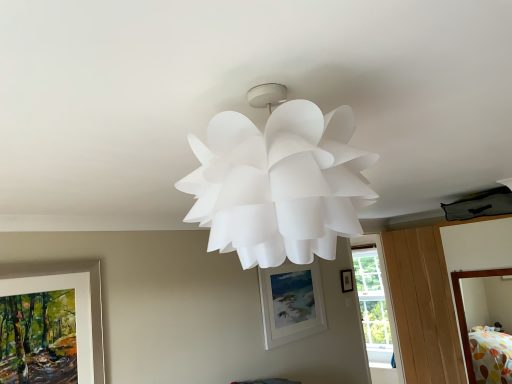
How much space does white matte picture frame at center, the 2th picture frame in the front-to-back sequence, occupy horizontally?

It is 1.56 inches.

What do you see at coordinates (76, 303) in the screenshot? The width and height of the screenshot is (512, 384). I see `matte white picture frame at left, the third picture frame when ordered from back to front` at bounding box center [76, 303].

What do you see at coordinates (376, 309) in the screenshot? I see `transparent glass window at center` at bounding box center [376, 309].

What is the approximate height of matte black picture frame at upper center, which is the 1th picture frame in right-to-left order?

matte black picture frame at upper center, which is the 1th picture frame in right-to-left order, is 8.77 inches tall.

I want to click on matte black picture frame at upper center, positioned as the 3th picture frame in left-to-right order, so click(346, 280).

What do you see at coordinates (464, 311) in the screenshot?
I see `polka dot fabric bed at lower right` at bounding box center [464, 311].

Where is `white matte picture frame at center, arranged as the 2th picture frame when viewed from the right`? This screenshot has width=512, height=384. white matte picture frame at center, arranged as the 2th picture frame when viewed from the right is located at coordinates (291, 302).

From the image's perspective, which is above, transparent glass window at center or matte black picture frame at upper center, positioned as the 3th picture frame in left-to-right order?

matte black picture frame at upper center, positioned as the 3th picture frame in left-to-right order, appears higher in the image.

Which of these two, transparent glass window at center or matte black picture frame at upper center, which appears as the first picture frame when viewed from the back, stands taller?

With more height is transparent glass window at center.

Is point (364, 272) farther from camera compared to point (347, 285)?

Yes, it is.

Measure the distance from transparent glass window at center to matte black picture frame at upper center, the 3th picture frame viewed from the front.

They are 1.41 meters apart.

From a real-world perspective, is transparent glass window at center above or below matte white picture frame at left, which is the 1th picture frame in front-to-back order?

In terms of real-world spatial position, transparent glass window at center is below matte white picture frame at left, which is the 1th picture frame in front-to-back order.

Identify the location of window below the matte white picture frame at left, which is the 1th picture frame in front-to-back order (from the image's perspective). (376, 309).

Who is bigger, transparent glass window at center or matte white picture frame at left, which is the 1th picture frame in front-to-back order?

With larger size is transparent glass window at center.

Which object is wider, transparent glass window at center or matte white picture frame at left, which ranks as the third picture frame in right-to-left order?

transparent glass window at center is wider.

Between white matte picture frame at center, arranged as the 2th picture frame when viewed from the right, and matte white picture frame at left, which ranks as the third picture frame in right-to-left order, which one has smaller size?

matte white picture frame at left, which ranks as the third picture frame in right-to-left order.

Visually, is white matte picture frame at center, arranged as the 2th picture frame when viewed from the right, positioned to the left or to the right of matte white picture frame at left, the third picture frame when ordered from back to front?

From the image, it's evident that white matte picture frame at center, arranged as the 2th picture frame when viewed from the right, is to the right of matte white picture frame at left, the third picture frame when ordered from back to front.

Based on the photo, from the image's perspective, is white matte picture frame at center, the second picture frame viewed from the left, over matte white picture frame at left, which ranks as the third picture frame in right-to-left order?

No, from the image's perspective, white matte picture frame at center, the second picture frame viewed from the left, is not above matte white picture frame at left, which ranks as the third picture frame in right-to-left order.

Between matte black picture frame at upper center, the 3th picture frame viewed from the front, and white matte picture frame at center, arranged as the 2th picture frame when viewed from the right, which one has smaller size?

matte black picture frame at upper center, the 3th picture frame viewed from the front.

Consider the image. How many degrees apart are the facing directions of matte black picture frame at upper center, which appears as the first picture frame when viewed from the back, and white matte picture frame at center, arranged as the 2th picture frame when viewed from the right?

The angular difference between matte black picture frame at upper center, which appears as the first picture frame when viewed from the back, and white matte picture frame at center, arranged as the 2th picture frame when viewed from the right, is 0.723 degrees.

Between matte black picture frame at upper center, which is the 1th picture frame in right-to-left order, and white matte picture frame at center, the 2th picture frame in the front-to-back sequence, which one has larger width?

With larger width is white matte picture frame at center, the 2th picture frame in the front-to-back sequence.

Based on the photo, does matte black picture frame at upper center, positioned as the 3th picture frame in left-to-right order, have a greater height compared to white matte picture frame at center, the 2th picture frame in the front-to-back sequence?

Incorrect, the height of matte black picture frame at upper center, positioned as the 3th picture frame in left-to-right order, is not larger of that of white matte picture frame at center, the 2th picture frame in the front-to-back sequence.

Is polka dot fabric bed at lower right located outside transparent glass window at center?

Indeed, polka dot fabric bed at lower right is completely outside transparent glass window at center.

How distant is polka dot fabric bed at lower right from transparent glass window at center?

The distance of polka dot fabric bed at lower right from transparent glass window at center is 7.19 feet.

From a real-world perspective, between polka dot fabric bed at lower right and transparent glass window at center, who is vertically lower?

transparent glass window at center.

Consider the image. Which object is further away from the camera, polka dot fabric bed at lower right or transparent glass window at center?

transparent glass window at center.

Is transparent glass window at center oriented towards polka dot fabric bed at lower right?

No, transparent glass window at center is not turned towards polka dot fabric bed at lower right.

From a real-world perspective, is transparent glass window at center physically above polka dot fabric bed at lower right?

No, from a real-world perspective, transparent glass window at center is not above polka dot fabric bed at lower right.

Looking at this image, from the image's perspective, which one is positioned higher, transparent glass window at center or polka dot fabric bed at lower right?

polka dot fabric bed at lower right.

Which is in front, point (364, 299) or point (469, 275)?

The point (469, 275) is in front.

From the image's perspective, is white matte picture frame at center, the second picture frame viewed from the left, over matte black picture frame at upper center, the 3th picture frame viewed from the front?

No, from the image's perspective, white matte picture frame at center, the second picture frame viewed from the left, is not above matte black picture frame at upper center, the 3th picture frame viewed from the front.

Measure the distance from white matte picture frame at center, the second picture frame viewed from the left, to matte black picture frame at upper center, the 3th picture frame viewed from the front.

white matte picture frame at center, the second picture frame viewed from the left, and matte black picture frame at upper center, the 3th picture frame viewed from the front, are 30.40 inches apart.

Is white matte picture frame at center, arranged as the 2th picture frame when viewed from the right, outside of matte black picture frame at upper center, which is the 1th picture frame in right-to-left order?

Indeed, white matte picture frame at center, arranged as the 2th picture frame when viewed from the right, is completely outside matte black picture frame at upper center, which is the 1th picture frame in right-to-left order.

In the image, there is a matte black picture frame at upper center, positioned as the 3th picture frame in left-to-right order. Identify the location of picture frame below it (from a real-world perspective). This screenshot has height=384, width=512. (291, 302).

From a real-world perspective, starting from the transparent glass window at center, which picture frame is the 2nd one vertically above it? Please provide its 2D coordinates.

[(346, 280)]

The image size is (512, 384). Find the location of `window below the matte white picture frame at left, the 1th picture frame in the left-to-right sequence (from the image's perspective)`. window below the matte white picture frame at left, the 1th picture frame in the left-to-right sequence (from the image's perspective) is located at coordinates (376, 309).

Looking at the image, which one is located closer to matte black picture frame at upper center, which is the 1th picture frame in right-to-left order, matte white picture frame at left, the 1th picture frame in the left-to-right sequence, or white matte picture frame at center, the second picture frame viewed from the left?

white matte picture frame at center, the second picture frame viewed from the left, lies closer to matte black picture frame at upper center, which is the 1th picture frame in right-to-left order, than the other object.

Considering their positions, is white matte picture frame at center, the second picture frame viewed from the left, positioned further to transparent glass window at center than matte black picture frame at upper center, positioned as the 3th picture frame in left-to-right order?

Based on the image, white matte picture frame at center, the second picture frame viewed from the left, appears to be further to transparent glass window at center.

Consider the image. Based on their spatial positions, is matte black picture frame at upper center, the 3th picture frame viewed from the front, or polka dot fabric bed at lower right closer to matte white picture frame at left, the third picture frame when ordered from back to front?

polka dot fabric bed at lower right is closer to matte white picture frame at left, the third picture frame when ordered from back to front.

Which object lies further to the anchor point matte black picture frame at upper center, which is the 1th picture frame in right-to-left order, polka dot fabric bed at lower right or transparent glass window at center?

The object further to matte black picture frame at upper center, which is the 1th picture frame in right-to-left order, is transparent glass window at center.

Considering their positions, is white matte picture frame at center, the second picture frame viewed from the left, positioned closer to matte black picture frame at upper center, which is the 1th picture frame in right-to-left order, than polka dot fabric bed at lower right?

Among the two, white matte picture frame at center, the second picture frame viewed from the left, is located nearer to matte black picture frame at upper center, which is the 1th picture frame in right-to-left order.

Which object lies nearer to the anchor point matte white picture frame at left, the third picture frame when ordered from back to front, transparent glass window at center or matte black picture frame at upper center, positioned as the 3th picture frame in left-to-right order?

matte black picture frame at upper center, positioned as the 3th picture frame in left-to-right order, is positioned closer to the anchor matte white picture frame at left, the third picture frame when ordered from back to front.

Estimate the real-world distances between objects in this image. Which object is closer to transparent glass window at center, white matte picture frame at center, the second picture frame viewed from the left, or matte white picture frame at left, the third picture frame when ordered from back to front?

white matte picture frame at center, the second picture frame viewed from the left.

Considering their positions, is transparent glass window at center positioned closer to white matte picture frame at center, the second picture frame viewed from the left, than polka dot fabric bed at lower right?

polka dot fabric bed at lower right lies closer to white matte picture frame at center, the second picture frame viewed from the left, than the other object.

Where is `picture frame between polka dot fabric bed at lower right and matte black picture frame at upper center, the 3th picture frame viewed from the front, from front to back`? The image size is (512, 384). picture frame between polka dot fabric bed at lower right and matte black picture frame at upper center, the 3th picture frame viewed from the front, from front to back is located at coordinates (291, 302).

Identify the location of picture frame between matte white picture frame at left, which is the 1th picture frame in front-to-back order, and matte black picture frame at upper center, which appears as the first picture frame when viewed from the back, along the z-axis. (291, 302).

At what (x,y) coordinates should I click in order to perform the action: click on picture frame between white matte picture frame at center, the second picture frame viewed from the left, and transparent glass window at center, along the z-axis. Please return your answer as a coordinate pair (x, y). This screenshot has height=384, width=512. Looking at the image, I should click on (346, 280).

Image resolution: width=512 pixels, height=384 pixels. I want to click on window between matte white picture frame at left, which ranks as the third picture frame in right-to-left order, and polka dot fabric bed at lower right, in the horizontal direction, so click(376, 309).